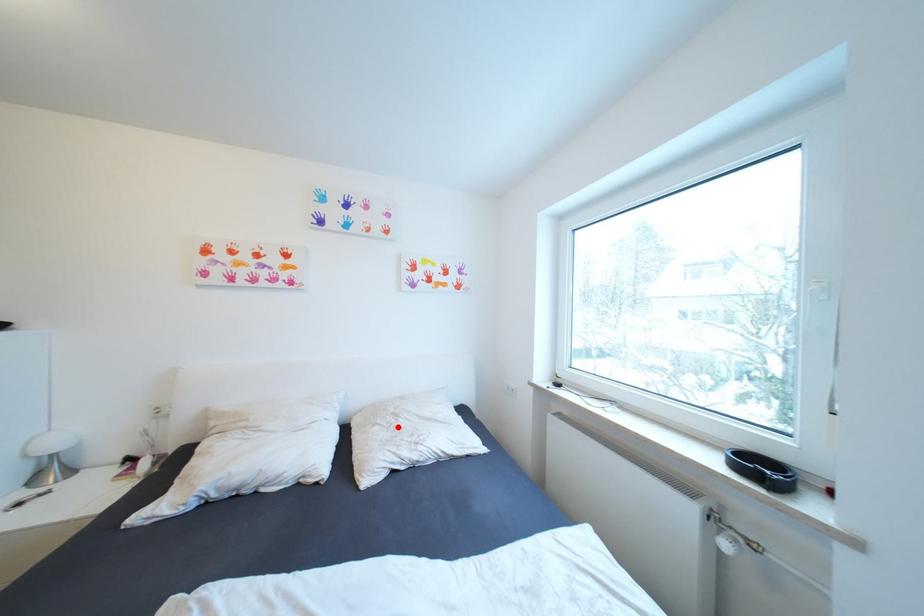
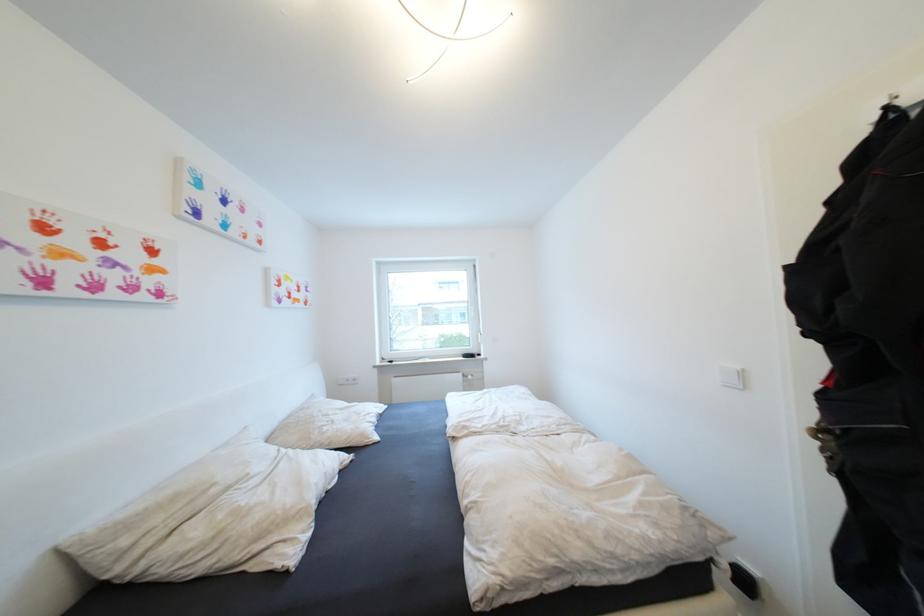
Question: I am providing you with two images of the same scene from different viewpoints. In image1, a red point is highlighted. Considering the same 3D point in image2, which of the following is correct?

Choices:
 (A) It is closer
 (B) It is farther

Answer: (A)